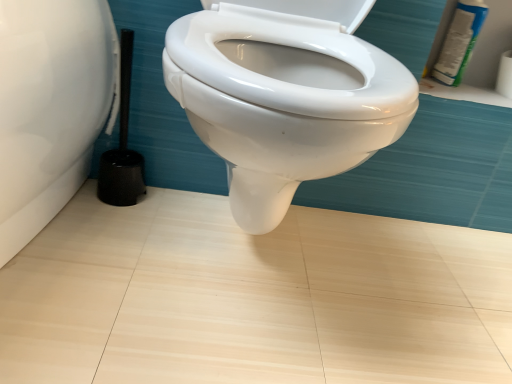
Question: From the image's perspective, relative to black plastic brush at left, is white glossy spray can at upper right above or below?

Choices:
 (A) below
 (B) above

Answer: (B)

Question: Do you think white glossy spray can at upper right is within black plastic brush at left, or outside of it?

Choices:
 (A) inside
 (B) outside

Answer: (B)

Question: From a real-world perspective, is white glossy spray can at upper right above or below black plastic brush at left?

Choices:
 (A) below
 (B) above

Answer: (B)

Question: Considering the positions of black plastic brush at left and white glossy spray can at upper right in the image, is black plastic brush at left bigger or smaller than white glossy spray can at upper right?

Choices:
 (A) small
 (B) big

Answer: (B)

Question: Is black plastic brush at left to the left or to the right of white glossy spray can at upper right in the image?

Choices:
 (A) right
 (B) left

Answer: (B)

Question: Relative to white glossy spray can at upper right, is black plastic brush at left in front or behind?

Choices:
 (A) behind
 (B) front

Answer: (B)

Question: Considering the positions of black plastic brush at left and white glossy spray can at upper right in the image, is black plastic brush at left wider or thinner than white glossy spray can at upper right?

Choices:
 (A) thin
 (B) wide

Answer: (B)